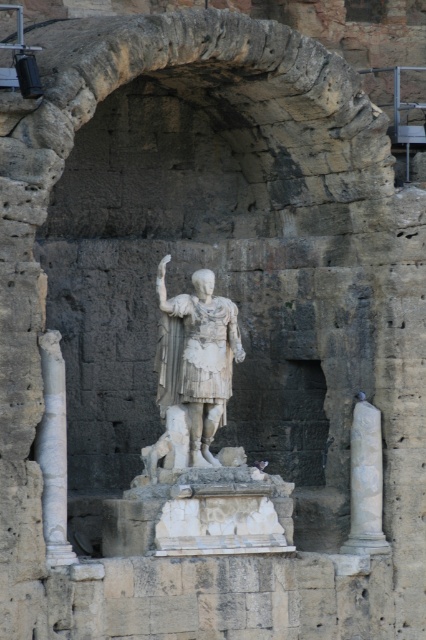
You are an archaeologist examining the ancient stone structure. You notice the white marble statue at center and the white marble column at right. Based on their positions, which one is higher up in the image?

The white marble statue at center is above the white marble column at right, so it is higher up in the image.

You are standing in front of the ancient stone structure and want to determine the relative positions of two points marked on the statue. Which point is closer to you, point (224, 416) or point (43, 492)?

Point (224, 416) is further to the viewer than point (43, 492), so point (43, 492) is closer to you.